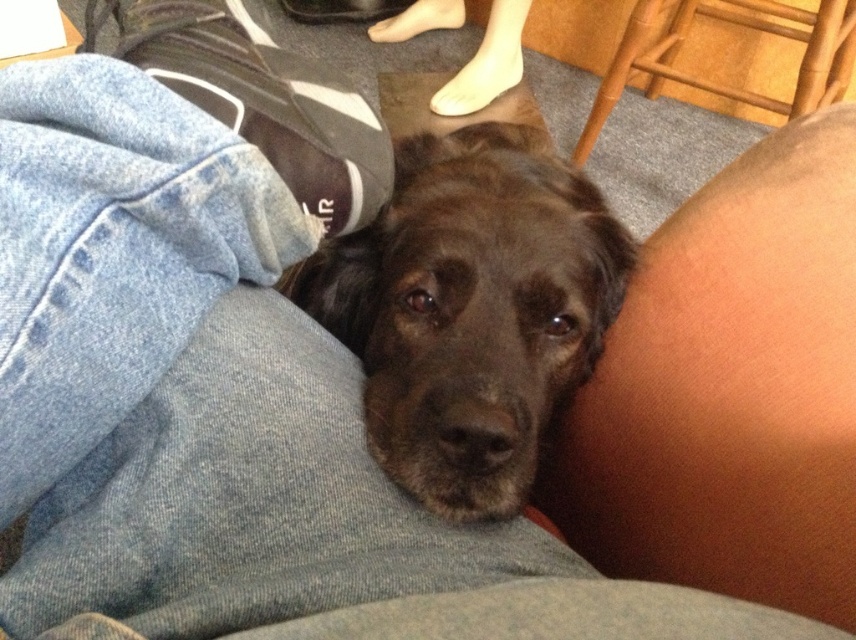
Based on the photo, which is more to the right, bamboo chair at upper right or skinny white foot at upper center?

bamboo chair at upper right

Is bamboo chair at upper right thinner than skinny white foot at upper center?

In fact, bamboo chair at upper right might be wider than skinny white foot at upper center.

This screenshot has width=856, height=640. What are the coordinates of `bamboo chair at upper right` in the screenshot? It's located at (722, 84).

Find the location of a particular element. This screenshot has height=640, width=856. bamboo chair at upper right is located at coordinates (722, 84).

Is point (539, 196) positioned after point (510, 19)?

No, (539, 196) is closer to viewer.

Who is more forward, (x=584, y=237) or (x=401, y=19)?

Point (x=584, y=237) is more forward.

Who is more forward, (584, 195) or (516, 49)?

Point (584, 195) is more forward.

In order to click on shiny brown fur at center in this screenshot , I will do `click(471, 308)`.

What do you see at coordinates (471, 308) in the screenshot? Image resolution: width=856 pixels, height=640 pixels. I see `shiny brown fur at center` at bounding box center [471, 308].

Does shiny brown fur at center appear over bamboo chair at upper right?

No, shiny brown fur at center is not above bamboo chair at upper right.

The width and height of the screenshot is (856, 640). Find the location of `shiny brown fur at center`. shiny brown fur at center is located at coordinates (471, 308).